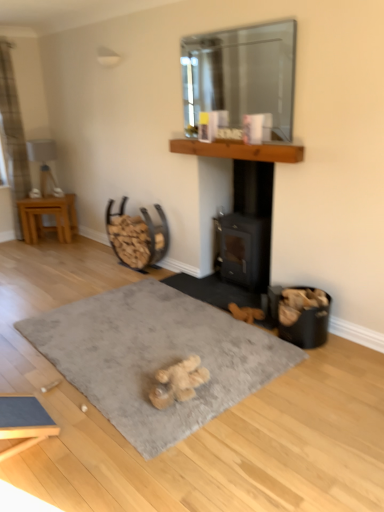
Locate an element on the screen. This screenshot has height=512, width=384. fuzzy beige teddy bear at center is located at coordinates (178, 382).

In order to face plaid fabric curtain at left, should I rotate leftwards or rightwards?

To face it directly, rotate left by 22.688 degrees.

Measure the distance between point (5, 153) and camera.

15.92 feet.

What do you see at coordinates (242, 74) in the screenshot?
I see `transparent glass mirror at upper center` at bounding box center [242, 74].

At what (x,y) coordinates should I click in order to perform the action: click on gray soft rug at center. Please return your answer as a coordinate pair (x, y). The width and height of the screenshot is (384, 512). Looking at the image, I should click on (155, 357).

Is brown wooden mantle at upper center with gray soft rug at center?

No, brown wooden mantle at upper center is not making contact with gray soft rug at center.

From the picture: What's the angular difference between brown wooden mantle at upper center and gray soft rug at center's facing directions?

The angular difference between brown wooden mantle at upper center and gray soft rug at center is 177 degrees.

Which of these two, brown wooden mantle at upper center or gray soft rug at center, is thinner?

Thinner between the two is brown wooden mantle at upper center.

Is transparent glass mirror at upper center aimed at black matte wood burning stove at center?

No, transparent glass mirror at upper center does not turn towards black matte wood burning stove at center.

Would you consider transparent glass mirror at upper center to be distant from black matte wood burning stove at center?

That's right, there is a large distance between transparent glass mirror at upper center and black matte wood burning stove at center.

From the image's perspective, which is above, transparent glass mirror at upper center or black matte wood burning stove at center?

From the image's view, transparent glass mirror at upper center is above.

Based on their positions, is transparent glass mirror at upper center located to the left or right of black matte wood burning stove at center?

transparent glass mirror at upper center is positioned on black matte wood burning stove at center's left side.

How many degrees apart are the facing directions of fuzzy beige teddy bear at center and transparent glass mirror at upper center?

The facing directions of fuzzy beige teddy bear at center and transparent glass mirror at upper center are 179 degrees apart.

Between fuzzy beige teddy bear at center and transparent glass mirror at upper center, which one appears on the left side from the viewer's perspective?

fuzzy beige teddy bear at center is more to the left.

Is fuzzy beige teddy bear at center facing towards transparent glass mirror at upper center?

No, fuzzy beige teddy bear at center is not oriented towards transparent glass mirror at upper center.

Is fuzzy beige teddy bear at center wider or thinner than transparent glass mirror at upper center?

Considering their sizes, fuzzy beige teddy bear at center looks broader than transparent glass mirror at upper center.

Is plaid fabric curtain at left at the back of metallic brown firewood rack at center-left?

No, metallic brown firewood rack at center-left's orientation is not away from plaid fabric curtain at left.

Would you say metallic brown firewood rack at center-left is outside plaid fabric curtain at left?

Yes, metallic brown firewood rack at center-left is not within plaid fabric curtain at left.

What's the angular difference between metallic brown firewood rack at center-left and plaid fabric curtain at left's facing directions?

91.1 degrees.

Considering the points (129, 229) and (12, 185), which point is in front, point (129, 229) or point (12, 185)?

The point (129, 229) is closer.

Which is more to the right, plaid fabric curtain at left or fuzzy beige teddy bear at center?

fuzzy beige teddy bear at center.

Is plaid fabric curtain at left oriented away from fuzzy beige teddy bear at center?

No, plaid fabric curtain at left is not facing the opposite direction of fuzzy beige teddy bear at center.

Based on the photo, considering the relative sizes of plaid fabric curtain at left and fuzzy beige teddy bear at center in the image provided, is plaid fabric curtain at left bigger than fuzzy beige teddy bear at center?

Indeed, plaid fabric curtain at left has a larger size compared to fuzzy beige teddy bear at center.

Find the location of a particular element. animal on the right of plaid fabric curtain at left is located at coordinates (178, 382).

From a real-world perspective, between plaid fabric curtain at left and metallic brown firewood rack at center-left, who is vertically lower?

In real-world perspective, metallic brown firewood rack at center-left is lower.

Is plaid fabric curtain at left to the left of metallic brown firewood rack at center-left from the viewer's perspective?

Yes, plaid fabric curtain at left is to the left of metallic brown firewood rack at center-left.

Which of these two, plaid fabric curtain at left or metallic brown firewood rack at center-left, stands shorter?

With less height is metallic brown firewood rack at center-left.

Is there a large distance between plaid fabric curtain at left and metallic brown firewood rack at center-left?

Yes, plaid fabric curtain at left and metallic brown firewood rack at center-left are quite far apart.

Does plaid fabric curtain at left have a lesser height compared to light brown wooden table at left?

No.

From a real-world perspective, is plaid fabric curtain at left positioned over light brown wooden table at left based on gravity?

Yes, from a real-world perspective, plaid fabric curtain at left is over light brown wooden table at left

Is plaid fabric curtain at left touching light brown wooden table at left?

No, plaid fabric curtain at left is not touching light brown wooden table at left.

The height and width of the screenshot is (512, 384). I want to click on table behind the plaid fabric curtain at left, so click(x=48, y=214).

Identify the location of yoga mat below the brown wooden mantle at upper center (from the image's perspective). (155, 357).

Find the location of a particular element. Image resolution: width=384 pixels, height=512 pixels. window screen on the left side of black matte wood burning stove at center is located at coordinates (242, 74).

When comparing their distances from black matte wood burning stove at center, does plaid fabric curtain at left or transparent glass mirror at upper center seem further?

plaid fabric curtain at left lies further to black matte wood burning stove at center than the other object.

When comparing their distances from plaid fabric curtain at left, does light brown wooden table at left or brown wooden mantle at upper center seem closer?

light brown wooden table at left.

Considering their positions, is brown wooden mantle at upper center positioned closer to fuzzy beige teddy bear at center than transparent glass mirror at upper center?

brown wooden mantle at upper center.

When comparing their distances from metallic brown firewood rack at center-left, does fuzzy beige teddy bear at center or gray soft rug at center seem further?

Among the two, fuzzy beige teddy bear at center is located further to metallic brown firewood rack at center-left.

Based on the photo, estimate the real-world distances between objects in this image. Which object is closer to brown wooden mantle at upper center, transparent glass mirror at upper center or black matte wood burning stove at center?

A: The object closer to brown wooden mantle at upper center is black matte wood burning stove at center.

Looking at the image, which one is located further to black matte wood burning stove at center, plaid fabric curtain at left or gray soft rug at center?

Based on the image, plaid fabric curtain at left appears to be further to black matte wood burning stove at center.

Looking at this image, based on their spatial positions, is plaid fabric curtain at left or gray soft rug at center further from light brown wooden table at left?

Answer: gray soft rug at center is positioned further to the anchor light brown wooden table at left.

Looking at the image, which one is located closer to transparent glass mirror at upper center, black matte wood burning stove at center or plaid fabric curtain at left?

Based on the image, black matte wood burning stove at center appears to be nearer to transparent glass mirror at upper center.

Locate an element on the screen. The image size is (384, 512). mantle located between transparent glass mirror at upper center and light brown wooden table at left in the depth direction is located at coordinates [x=239, y=150].

Locate an element on the screen. This screenshot has width=384, height=512. animal positioned between gray soft rug at center and plaid fabric curtain at left from near to far is located at coordinates (178, 382).

Where is `rocking chair between gray soft rug at center and plaid fabric curtain at left in the front-back direction`? rocking chair between gray soft rug at center and plaid fabric curtain at left in the front-back direction is located at coordinates (137, 236).

The image size is (384, 512). Find the location of `curtain between gray soft rug at center and light brown wooden table at left from front to back`. curtain between gray soft rug at center and light brown wooden table at left from front to back is located at coordinates (13, 134).